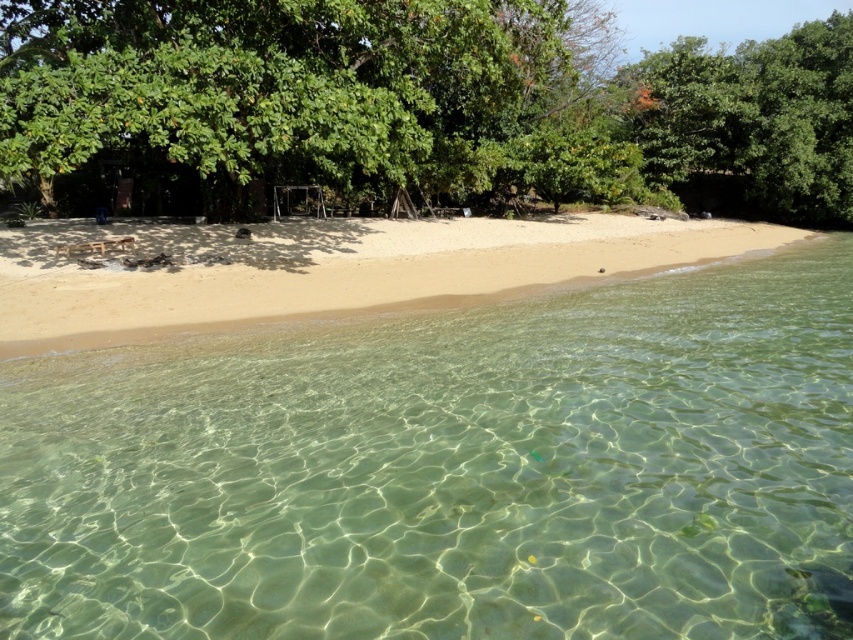
Question: Does sandy beach at center lie in front of green leafy tree at upper right?

Choices:
 (A) yes
 (B) no

Answer: (A)

Question: Considering the relative positions of green leafy tree at upper center and green leafy tree at upper right in the image provided, where is green leafy tree at upper center located with respect to green leafy tree at upper right?

Choices:
 (A) right
 (B) left

Answer: (B)

Question: Is clear water at center to the left of green leafy tree at upper center from the viewer's perspective?

Choices:
 (A) no
 (B) yes

Answer: (B)

Question: Which of these objects is positioned farthest from the green leafy tree at upper right?

Choices:
 (A) sandy beach at center
 (B) green leafy tree at upper center

Answer: (A)

Question: Based on their relative distances, which object is farther from the clear water at center?

Choices:
 (A) green leafy tree at upper center
 (B) sandy beach at center
 (C) green leafy tree at upper right

Answer: (C)

Question: Estimate the real-world distances between objects in this image. Which object is farther from the green leafy tree at upper right?

Choices:
 (A) sandy beach at center
 (B) green leafy tree at upper center

Answer: (A)